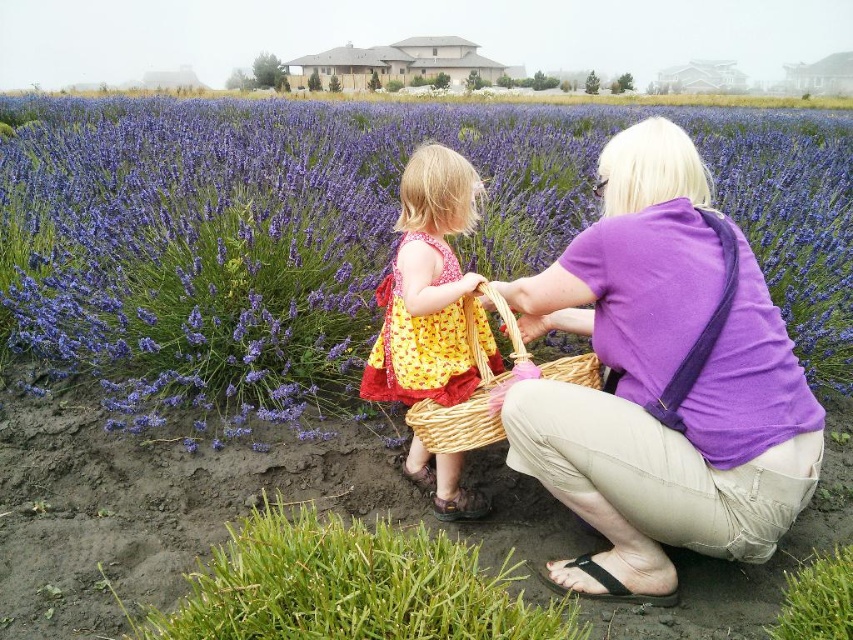
Is point (178, 260) farther from camera compared to point (404, 392)?

Yes, point (178, 260) is behind point (404, 392).

Can you confirm if purple soft lavender at center is smaller than yellow cotton dress at center?

Incorrect, purple soft lavender at center is not smaller in size than yellow cotton dress at center.

Does point (759, 218) come behind point (386, 390)?

Yes, it is behind point (386, 390).

In order to click on purple soft lavender at center in this screenshot , I will do `click(248, 240)`.

Which of these two, purple cotton shirt at center or yellow cotton dress at center, stands shorter?

yellow cotton dress at center

Between point (659, 307) and point (422, 326), which one is positioned in front?

Point (659, 307) is more forward.

Locate an element on the screen. The image size is (853, 640). purple cotton shirt at center is located at coordinates (660, 381).

Is purple soft lavender at center to the right of woven straw basket at center from the viewer's perspective?

Incorrect, purple soft lavender at center is not on the right side of woven straw basket at center.

Is point (54, 157) closer to camera compared to point (461, 435)?

That is False.

I want to click on purple soft lavender at center, so (248, 240).